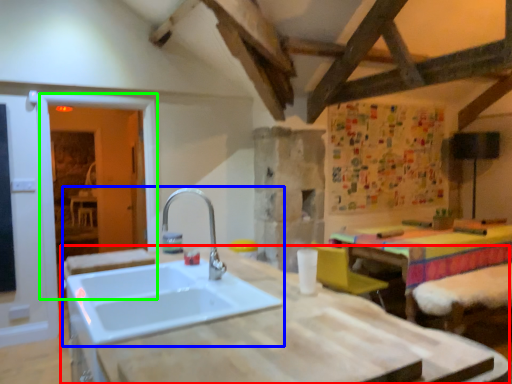
Question: Which object is positioned farthest from countertop (highlighted by a red box)? Select from sink (highlighted by a blue box) and glass door (highlighted by a green box).

Choices:
 (A) sink
 (B) glass door

Answer: (B)